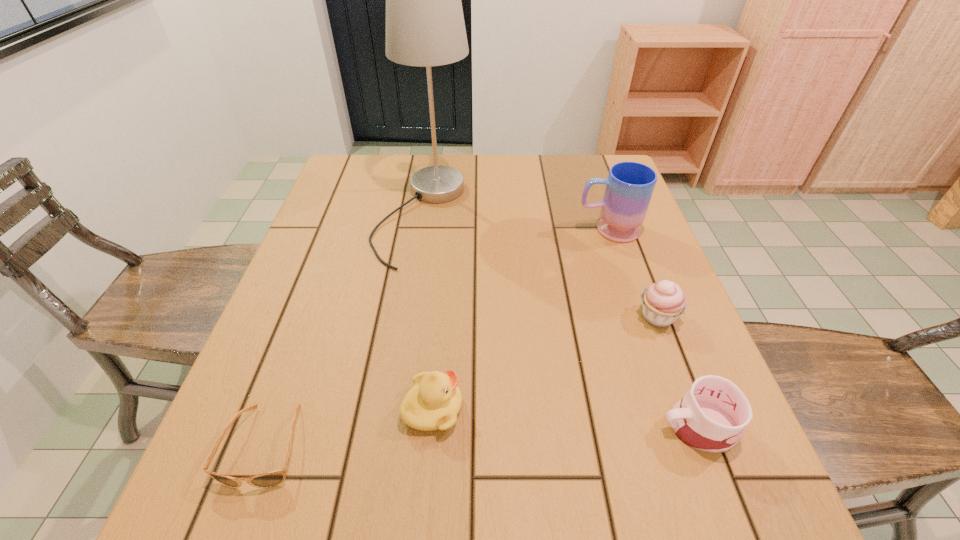
This screenshot has height=540, width=960. I want to click on vacant space that satisfies the following two spatial constraints: 1. on the side with the handle of the nearer mug; 2. on the front-facing side of the shortest object, so click(706, 446).

Identify the location of free location that satisfies the following two spatial constraints: 1. on the side with the handle of the nearer mug; 2. on the front-facing side of the leftmost object. (706, 446).

At what (x,y) coordinates should I click in order to perform the action: click on blank space that satisfies the following two spatial constraints: 1. on the beak of the duckling; 2. on the front-facing side of the shortest object. Please return your answer as a coordinate pair (x, y). This screenshot has width=960, height=540. Looking at the image, I should click on (430, 446).